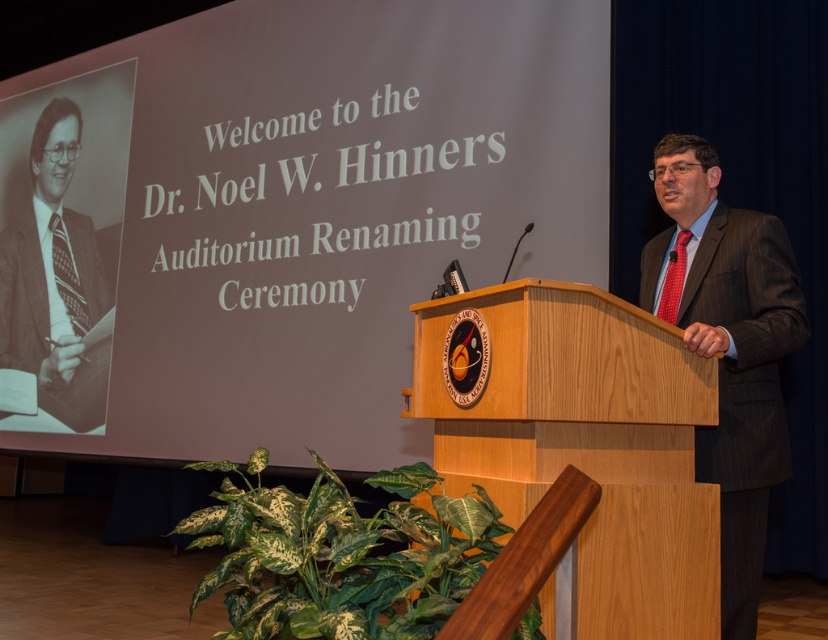
Question: Which object appears closest to the camera in this image?

Choices:
 (A) patterned fabric tie at center
 (B) red textured tie at center
 (C) matte black suit at left
 (D) brown pinstripe suit at center

Answer: (D)

Question: Is matte black suit at left smaller than red textured tie at center?

Choices:
 (A) yes
 (B) no

Answer: (B)

Question: Can you confirm if wooden podium at center is positioned below patterned fabric tie at center?

Choices:
 (A) yes
 (B) no

Answer: (A)

Question: Does matte black suit at left have a greater width compared to red textured tie at center?

Choices:
 (A) yes
 (B) no

Answer: (A)

Question: Which object is the farthest from the patterned fabric tie at center?

Choices:
 (A) red textured tie at center
 (B) brown pinstripe suit at center
 (C) matte black suit at left
 (D) wooden podium at center

Answer: (A)

Question: Based on their relative distances, which object is farther from the matte black suit at left?

Choices:
 (A) wooden podium at center
 (B) red textured tie at center
 (C) patterned fabric tie at center
 (D) brown pinstripe suit at center

Answer: (B)